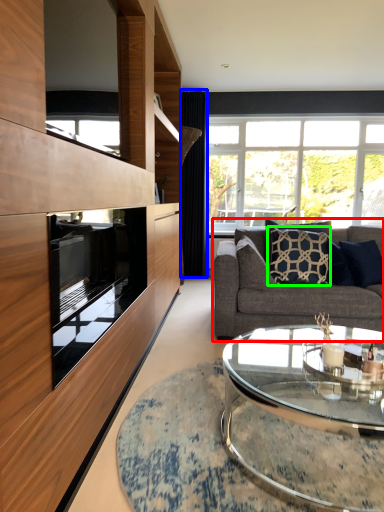
Question: Which is nearer to the studio couch (highlighted by a red box)? curtain (highlighted by a blue box) or pillow (highlighted by a green box).

Choices:
 (A) curtain
 (B) pillow

Answer: (B)